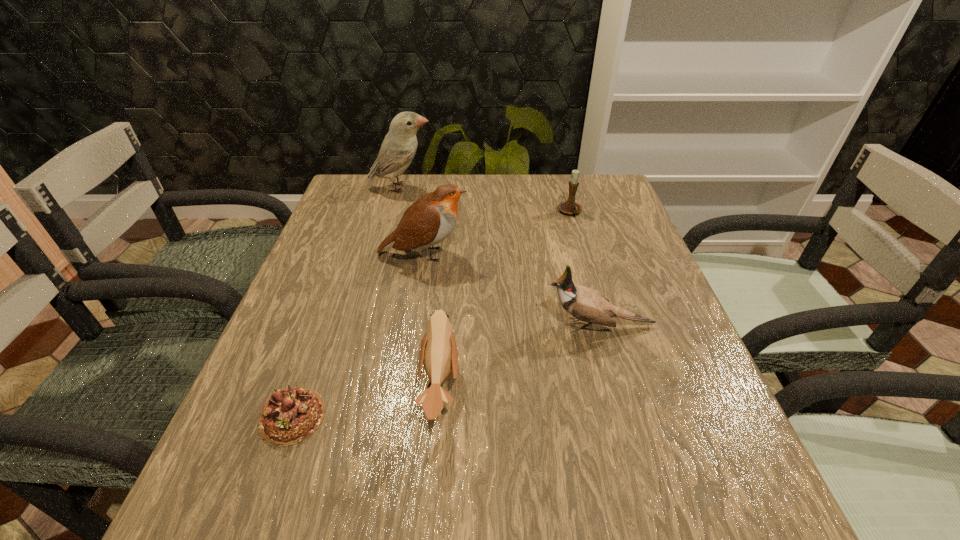
Where is `the tallest bird`? This screenshot has height=540, width=960. the tallest bird is located at coordinates (398, 149).

Locate an element on the screen. The height and width of the screenshot is (540, 960). the tallest object is located at coordinates (398, 149).

The height and width of the screenshot is (540, 960). What are the coordinates of `the second farthest bird` in the screenshot? It's located at (431, 219).

The image size is (960, 540). In order to click on the rightmost bird in this screenshot , I will do `click(585, 304)`.

The height and width of the screenshot is (540, 960). Find the location of `the fourth shortest object`. the fourth shortest object is located at coordinates (585, 304).

Find the location of a particular element. candle holder is located at coordinates (570, 207).

Locate an element on the screen. This screenshot has width=960, height=540. the shortest bird is located at coordinates (438, 352).

This screenshot has height=540, width=960. What are the coordinates of `the shortest object` in the screenshot? It's located at point(291,415).

Where is `free space located 0.050m at the face of the farthest object`? free space located 0.050m at the face of the farthest object is located at coordinates (450, 188).

The image size is (960, 540). I want to click on vacant region located at the face of the third nearest bird, so click(x=547, y=254).